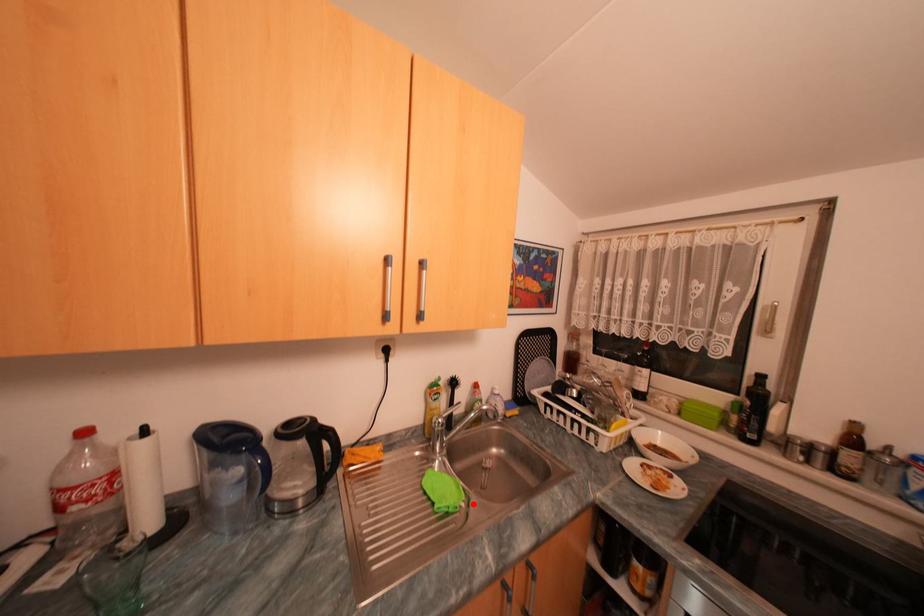
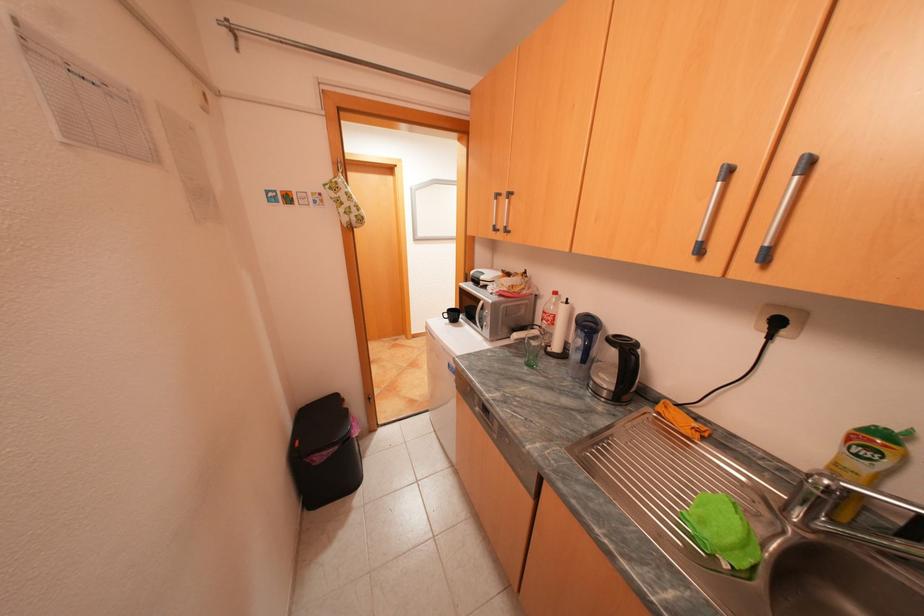
Question: I am providing you with two images of the same scene from different viewpoints. In image1, a red point is highlighted. Considering the same 3D point in image2, which of the following is correct?

Choices:
 (A) It is closer
 (B) It is farther

Answer: (A)